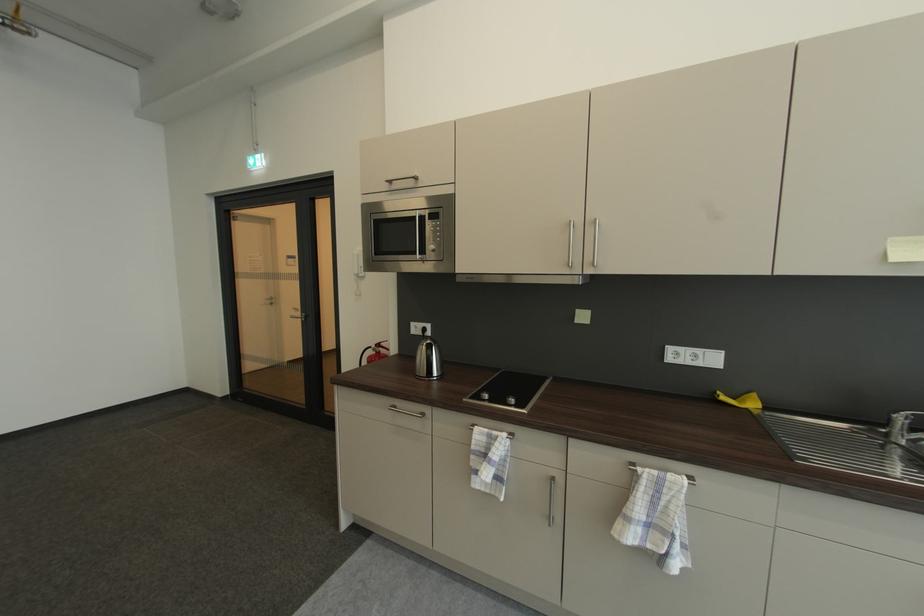
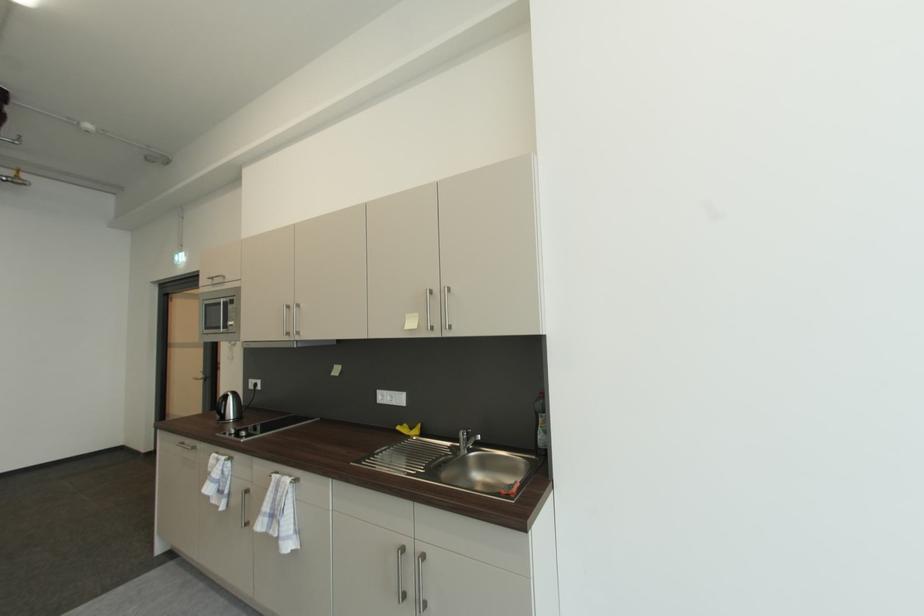
What movement of the cameraman would produce the second image?

The cameraman moved toward right, backward.